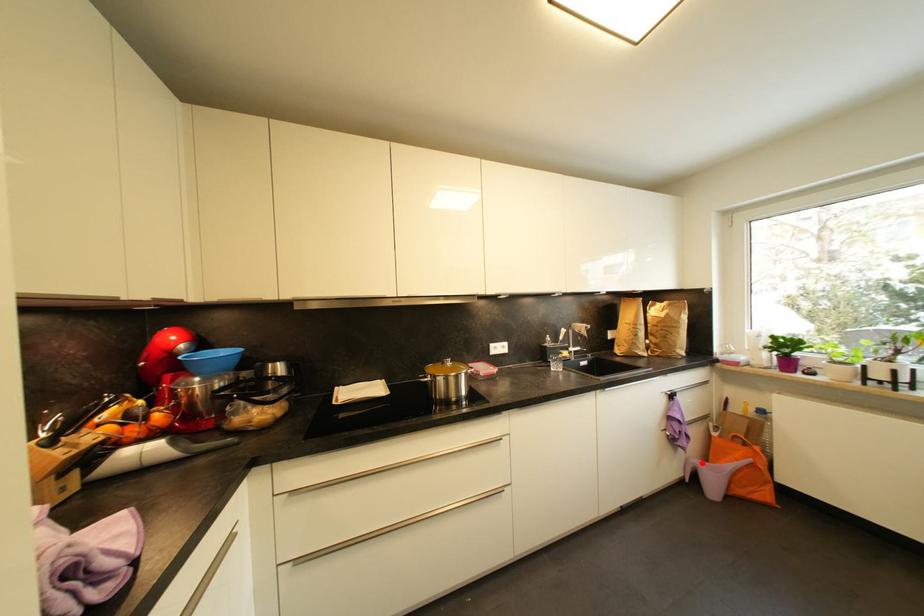
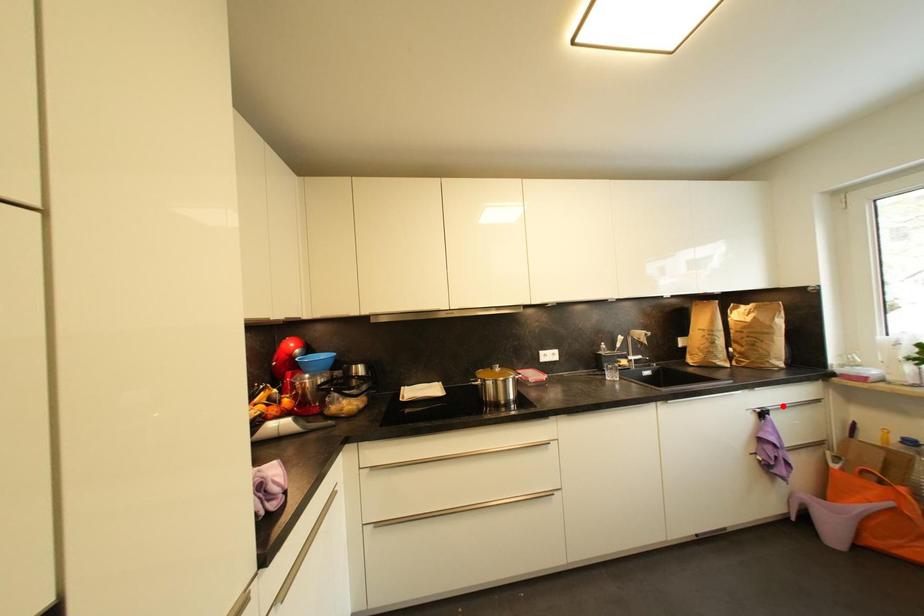
I am providing you with two images of the same scene from different viewpoints. A red point is marked on the first image and another point is marked on the second image. Do the highlighted points in image1 and image2 indicate the same real-world spot?

No